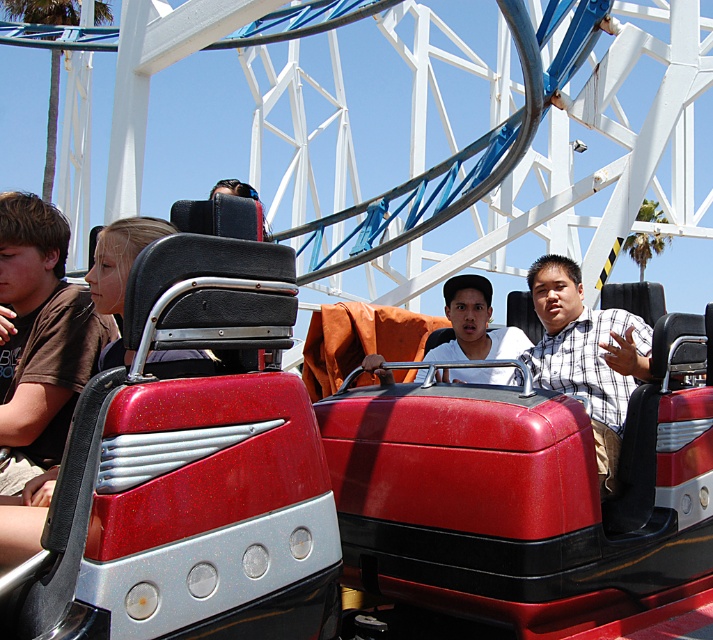
Question: From the image, what is the correct spatial relationship of brown cotton shirt at left in relation to white matte shirt at center?

Choices:
 (A) right
 (B) left

Answer: (B)

Question: Which of the following is the closest to the observer?

Choices:
 (A) (518, 349)
 (B) (533, 296)
 (C) (14, 426)

Answer: (C)

Question: Estimate the real-world distances between objects in this image. Which object is farther from the brown cotton shirt at left?

Choices:
 (A) white matte shirt at center
 (B) checkered fabric shirt at center

Answer: (B)

Question: Which object is positioned farthest from the checkered fabric shirt at center?

Choices:
 (A) white matte shirt at center
 (B) brown cotton shirt at left

Answer: (B)

Question: In this image, where is brown cotton shirt at left located relative to white matte shirt at center?

Choices:
 (A) left
 (B) right

Answer: (A)

Question: Is brown cotton shirt at left positioned at the back of white matte shirt at center?

Choices:
 (A) no
 (B) yes

Answer: (A)